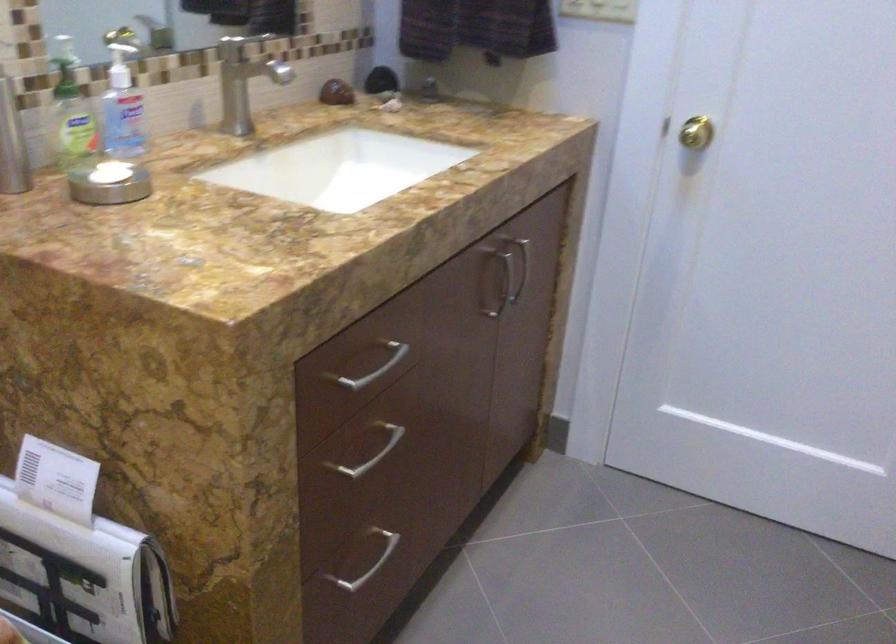
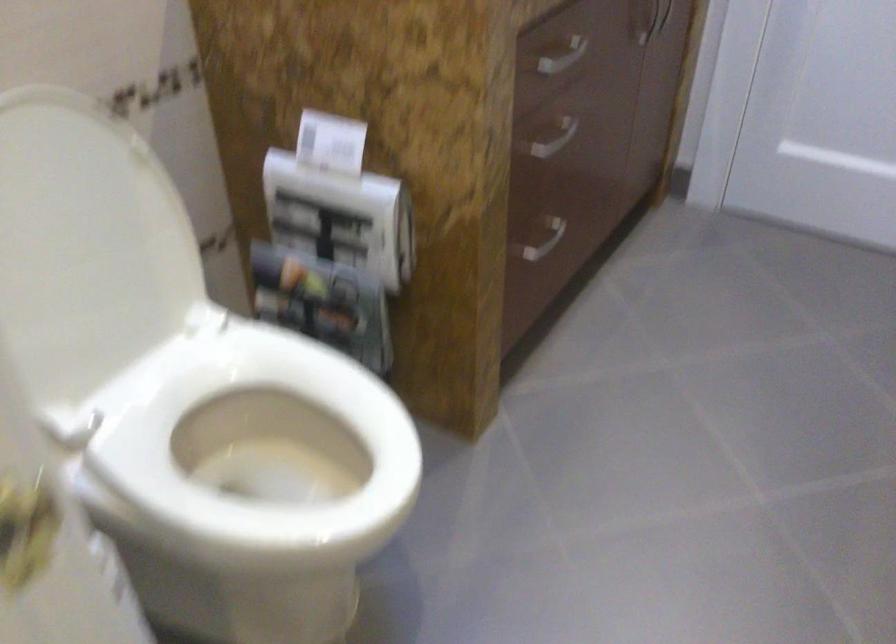
Find the pixel in the second image that matches [381,440] in the first image.

(554, 138)